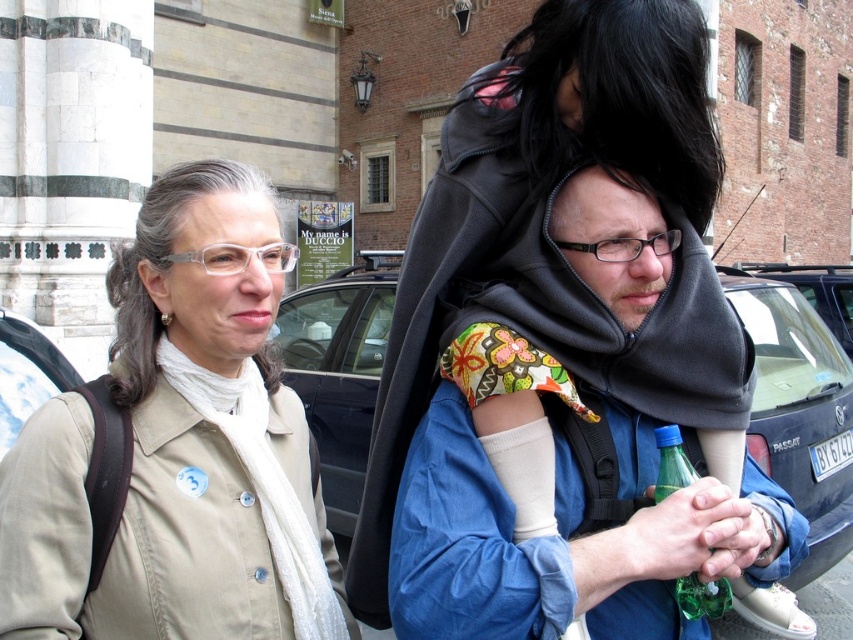
Is blue cotton hoodie at center shorter than blue matte car at center?

Correct, blue cotton hoodie at center is not as tall as blue matte car at center.

Find the location of `blue cotton hoodie at center`. blue cotton hoodie at center is located at coordinates (556, 548).

Find the location of `blue cotton hoodie at center`. blue cotton hoodie at center is located at coordinates (556, 548).

Describe the element at coordinates (556, 548) in the screenshot. I see `blue cotton hoodie at center` at that location.

Can you confirm if blue cotton hoodie at center is positioned to the left of green glass bottle at center?

Correct, you'll find blue cotton hoodie at center to the left of green glass bottle at center.

Is point (409, 461) farther from viewer compared to point (717, 588)?

Yes, it is.

This screenshot has height=640, width=853. What are the coordinates of `blue cotton hoodie at center` in the screenshot? It's located at (556, 548).

Who is taller, beige fabric jacket at upper left or blue cotton hoodie at center?

With more height is beige fabric jacket at upper left.

From the picture: Is beige fabric jacket at upper left thinner than blue cotton hoodie at center?

Yes, beige fabric jacket at upper left is thinner than blue cotton hoodie at center.

This screenshot has height=640, width=853. In order to click on beige fabric jacket at upper left in this screenshot , I will do `click(180, 445)`.

Locate an element on the screen. This screenshot has height=640, width=853. beige fabric jacket at upper left is located at coordinates [x=180, y=445].